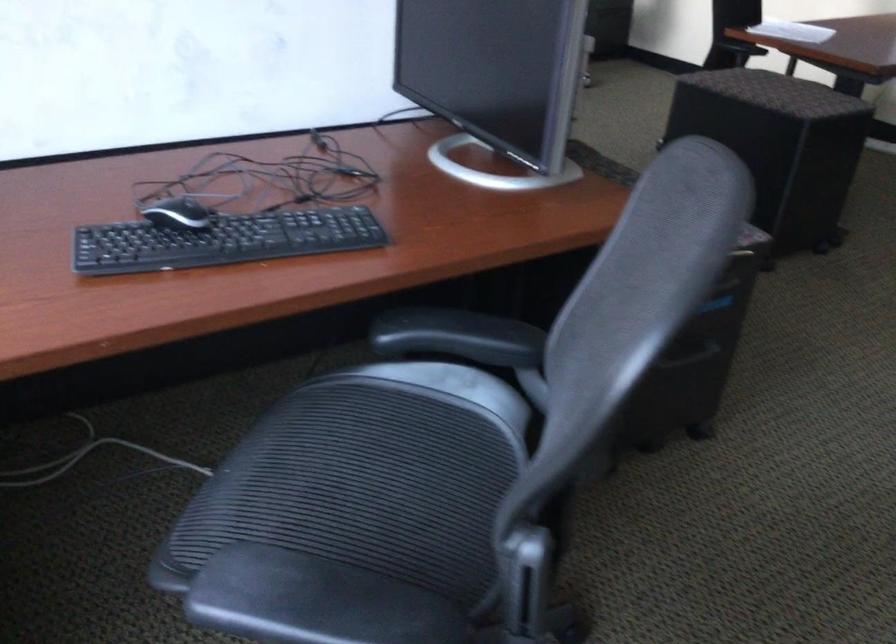
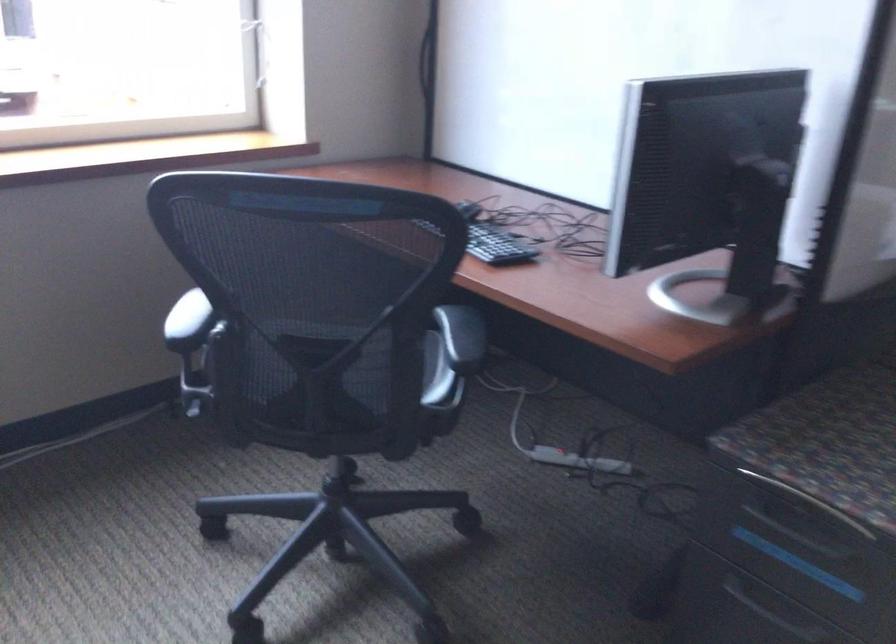
Locate, in the second image, the point that corresponds to (446,408) in the first image.

(435, 373)